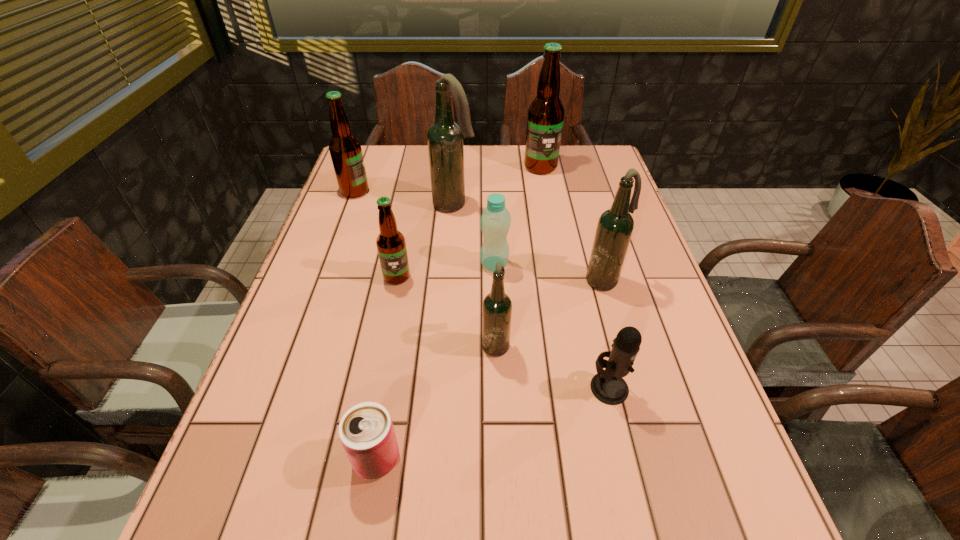
At what (x,y) coordinates should I click in order to perform the action: click on empty space between the leftmost brown beer bottle and the second brown beer bottle from left to right. Please return your answer as a coordinate pair (x, y). This screenshot has width=960, height=540. Looking at the image, I should click on (376, 234).

This screenshot has width=960, height=540. What are the coordinates of `vacant region between the rightmost dark beer bottle and the second farthest brown beer bottle` in the screenshot? It's located at (480, 236).

Image resolution: width=960 pixels, height=540 pixels. I want to click on vacant region between the microphone and the rightmost dark beer bottle, so click(607, 334).

The image size is (960, 540). Identify the location of free point between the fifth beer bottle from right to left and the farthest dark beer bottle. (425, 241).

In order to click on free point between the fourth beer bottle from right to left and the smallest dark beer bottle in this screenshot , I will do `click(475, 274)`.

Identify which object is located as the sixth nearest to the smallest brown beer bottle. Please provide its 2D coordinates. Your answer should be formatted as a tuple, i.e. [(x, y)], where the tuple contains the x and y coordinates of a point satisfying the conditions above.

[(615, 226)]

Identify which object is the third closest to the farthest object. Please provide its 2D coordinates. Your answer should be formatted as a tuple, i.e. [(x, y)], where the tuple contains the x and y coordinates of a point satisfying the conditions above.

[(615, 226)]

Identify the location of the fourth closest beer bottle relative to the smallest dark beer bottle. (345, 149).

You are a GUI agent. You are given a task and a screenshot of the screen. Output one action in this format:
    pyautogui.click(x=<x>, y=<y>)
    Task: Click on the beer bottle object that ranks as the second closest to the bottle
    This screenshot has height=540, width=960.
    Given the screenshot: What is the action you would take?
    pyautogui.click(x=497, y=307)

Identify the location of brown beer bottle object that ranks as the closest to the leftmost dark beer bottle. (545, 119).